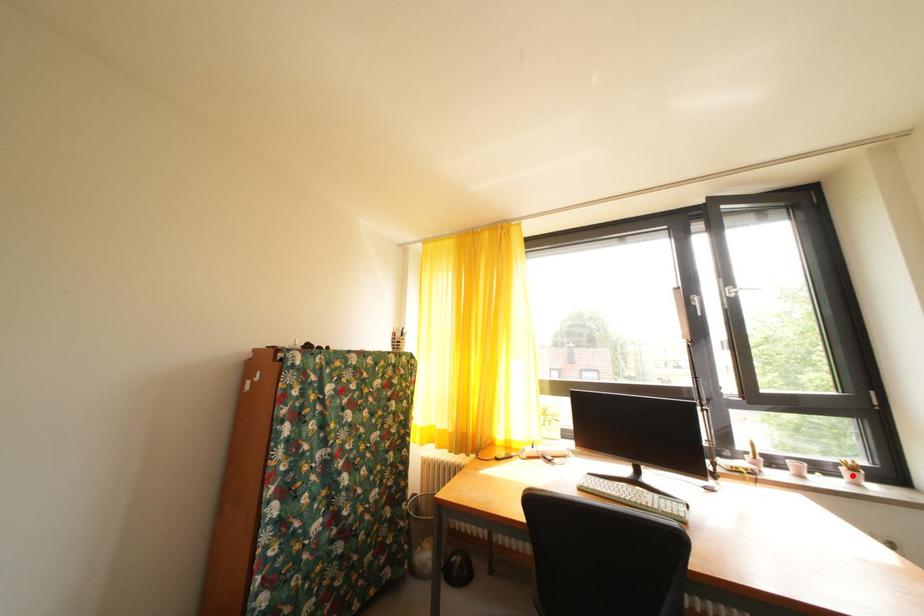
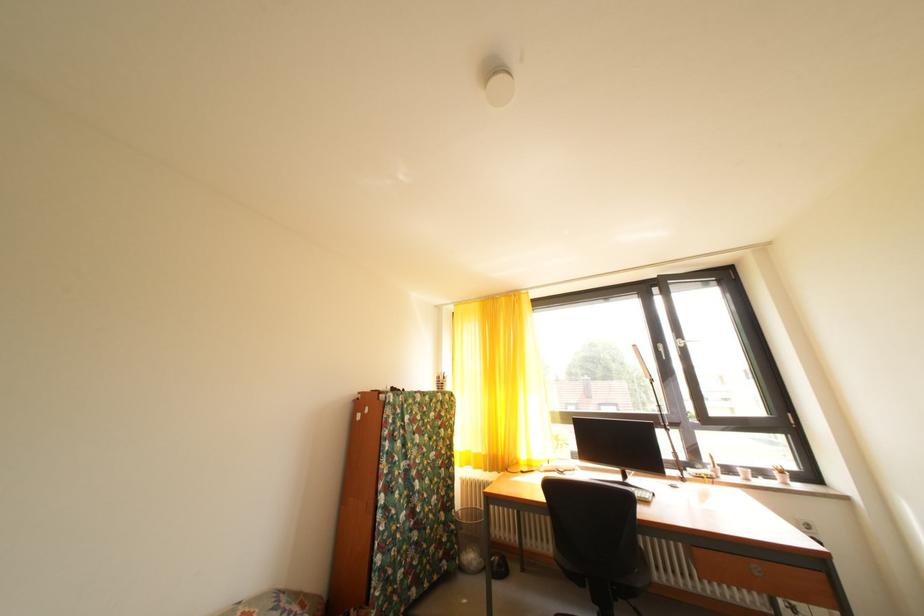
Question: I am providing you with two images of the same scene from different viewpoints. A red point is marked on the first image. Is the red point's position out of view in image 2?

Choices:
 (A) Yes
 (B) No

Answer: (B)